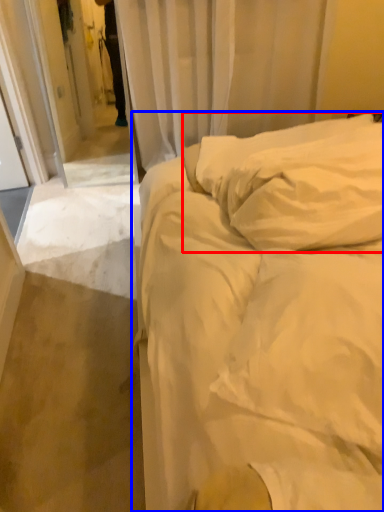
Question: Which point is further to the camera, pillow (highlighted by a red box) or bed (highlighted by a blue box)?

Choices:
 (A) pillow
 (B) bed

Answer: (A)